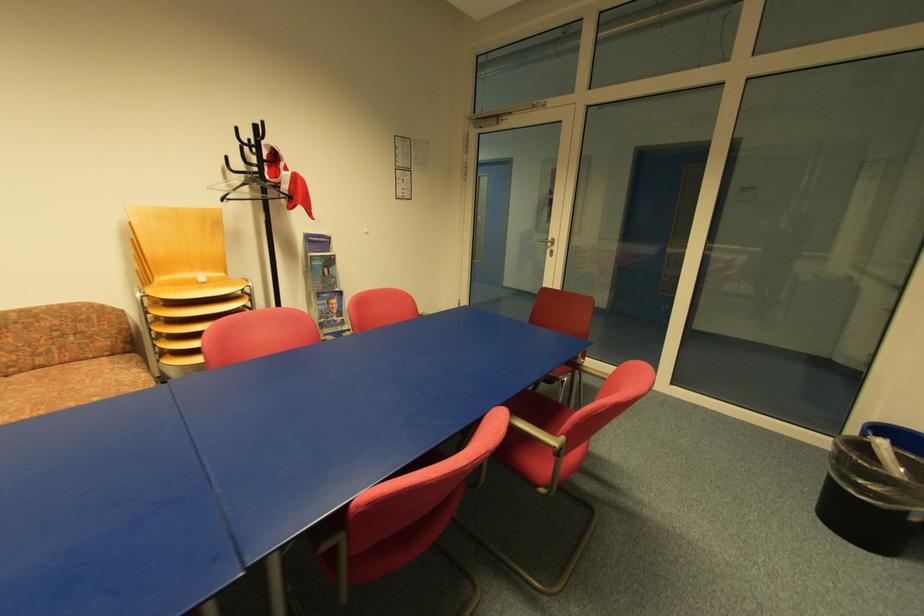
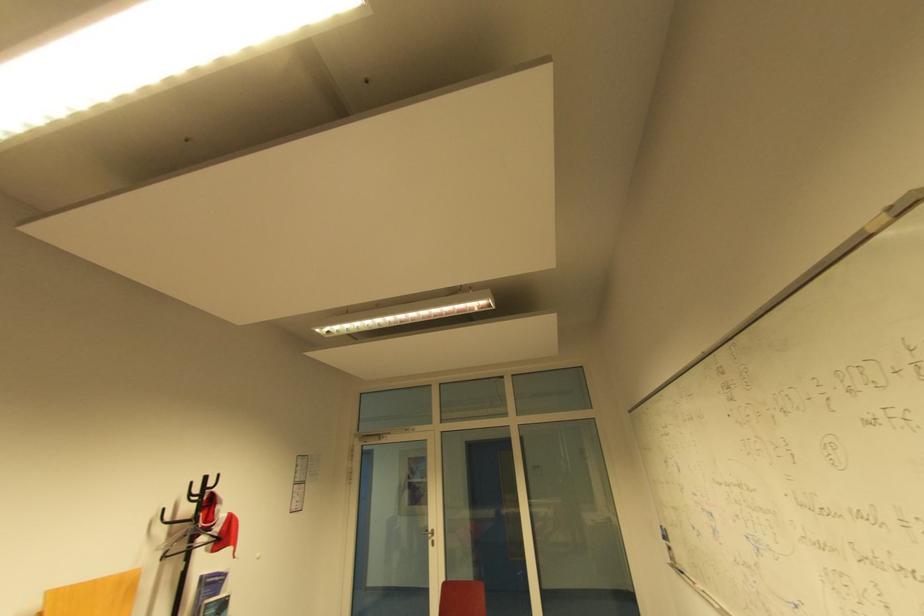
In the second image, find the point that corresponds to (x=266, y=124) in the first image.

(224, 476)